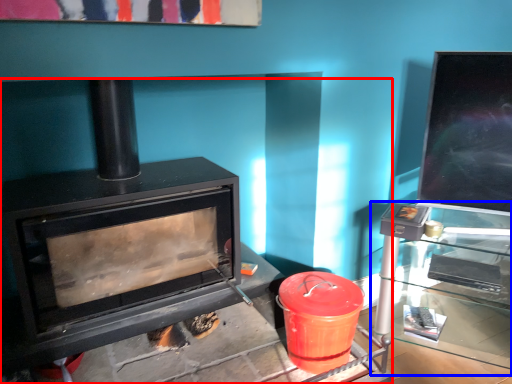
Question: Which object appears closest to the camera in this image, wood burning stove (highlighted by a red box) or table (highlighted by a blue box)?

Choices:
 (A) wood burning stove
 (B) table

Answer: (A)